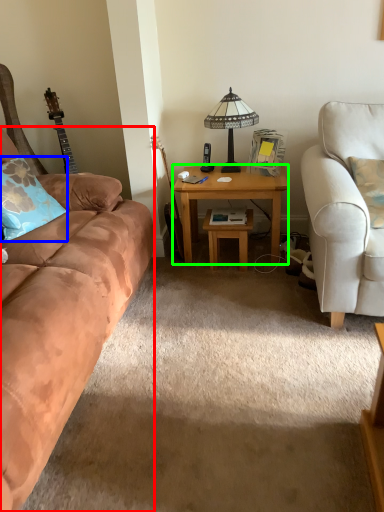
Question: Based on their relative distances, which object is nearer to studio couch (highlighted by a red box)? Choose from pillow (highlighted by a blue box) and desk (highlighted by a green box).

Choices:
 (A) pillow
 (B) desk

Answer: (A)